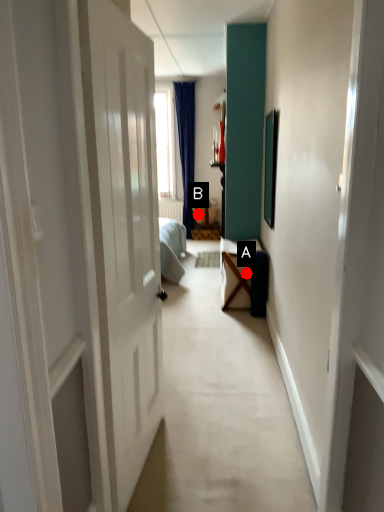
Question: Two points are circled on the image, labeled by A and B beside each circle. Which point appears farthest from the camera in this image?

Choices:
 (A) A is further
 (B) B is further

Answer: (B)